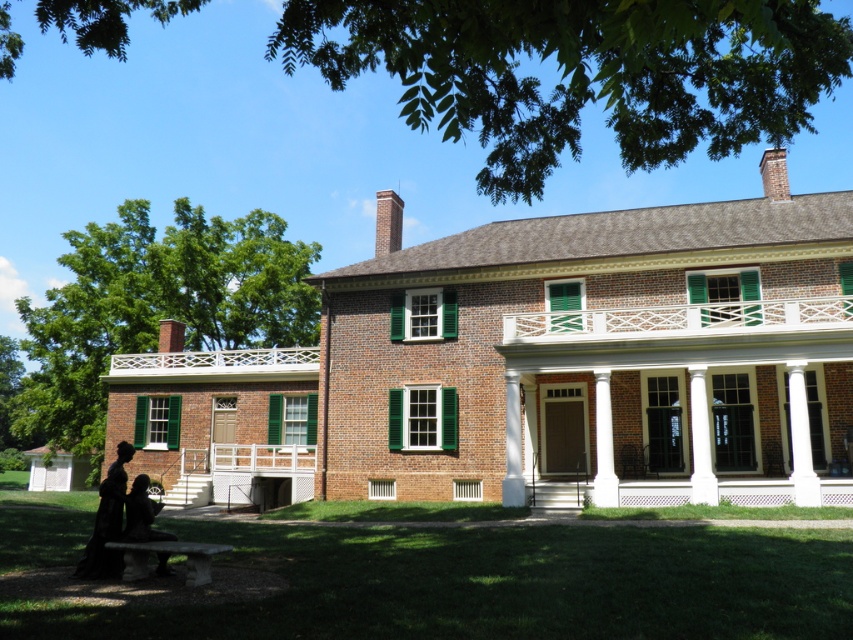
You are standing in front of the house and want to walk from the dark brown fur at lower left to the white painted wood porch at upper center. Which direction should you move relative to the house?

You should move towards the house to reach the white painted wood porch at upper center from the dark brown fur at lower left since the porch is closer to you than the fur.

You are standing in front of the two story brick house and want to sit on the white painted wood porch at upper center. To get there from your current position near the black velvet dress at lower left, which direction should you move?

To reach the white painted wood porch at upper center from the black velvet dress at lower left, you should move to the right since the white painted wood porch at upper center is positioned to the right of the black velvet dress at lower left.